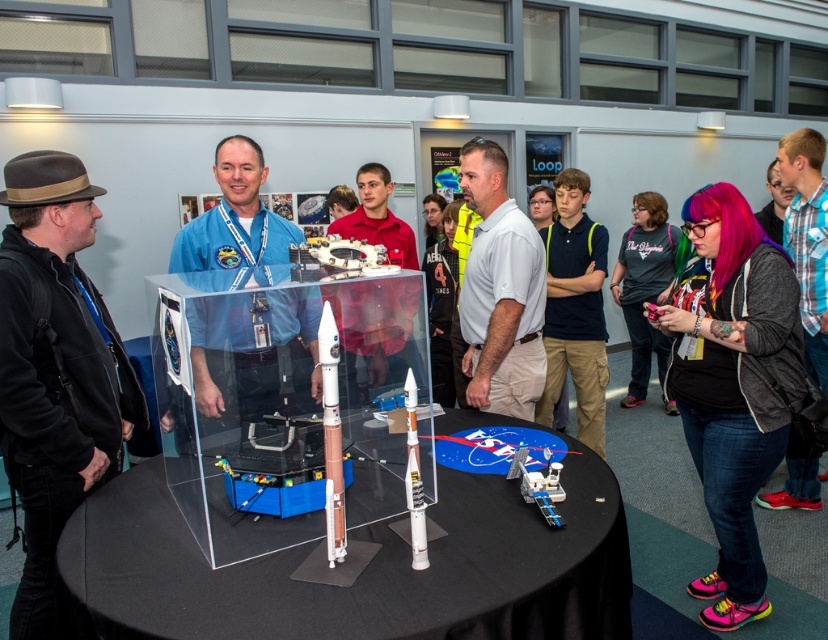
Who is higher up, dark blue shirt at center or shiny metallic satellite at center?

dark blue shirt at center is above.

Is dark blue shirt at center to the right of shiny metallic satellite at center from the viewer's perspective?

Indeed, dark blue shirt at center is positioned on the right side of shiny metallic satellite at center.

Is point (567, 200) closer to camera compared to point (547, 512)?

That is False.

Locate an element on the screen. Image resolution: width=828 pixels, height=640 pixels. dark blue shirt at center is located at coordinates (575, 308).

Who is positioned more to the right, dark blue shirt at center or matte orange rocket at center?

From the viewer's perspective, dark blue shirt at center appears more on the right side.

Does dark blue shirt at center appear under matte orange rocket at center?

No, dark blue shirt at center is not below matte orange rocket at center.

Between point (571, 342) and point (330, 552), which one is positioned behind?

The point (571, 342) is behind.

Image resolution: width=828 pixels, height=640 pixels. I want to click on dark blue shirt at center, so click(575, 308).

What are the coordinates of `black plastic table at center` in the screenshot? It's located at (360, 572).

Image resolution: width=828 pixels, height=640 pixels. In order to click on black plastic table at center in this screenshot , I will do `click(360, 572)`.

At what (x,y) coordinates should I click in order to perform the action: click on black plastic table at center. Please return your answer as a coordinate pair (x, y). The image size is (828, 640). Looking at the image, I should click on (360, 572).